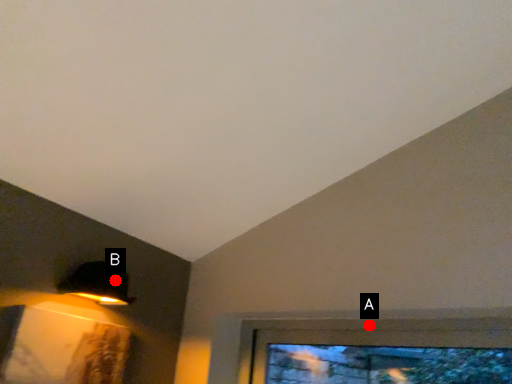
Question: Two points are circled on the image, labeled by A and B beside each circle. Which point is farther to the camera?

Choices:
 (A) A is further
 (B) B is further

Answer: (A)